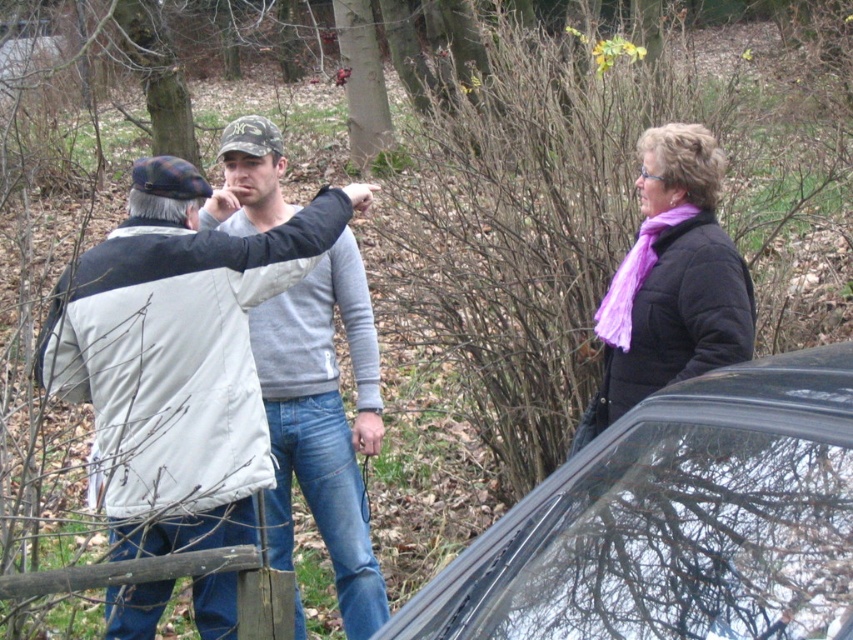
Question: Among these objects, which one is nearest to the camera?

Choices:
 (A) purple quilted jacket at upper right
 (B) camo fabric baseball cap at center
 (C) black glossy car at lower right

Answer: (C)

Question: Is black glossy car at lower right wider than camo fabric baseball cap at center?

Choices:
 (A) no
 (B) yes

Answer: (B)

Question: Which object is farther from the camera taking this photo?

Choices:
 (A) purple quilted jacket at upper right
 (B) camo fabric baseball cap at center
 (C) gray fleece jacket at center
 (D) black glossy car at lower right

Answer: (B)

Question: Does gray fleece jacket at center appear on the right side of purple quilted jacket at upper right?

Choices:
 (A) yes
 (B) no

Answer: (B)

Question: Which of these objects is positioned closest to the black glossy car at lower right?

Choices:
 (A) purple quilted jacket at upper right
 (B) camo fabric baseball cap at center
 (C) gray fleece jacket at center

Answer: (A)

Question: Can you confirm if black glossy car at lower right is wider than purple quilted jacket at upper right?

Choices:
 (A) no
 (B) yes

Answer: (B)